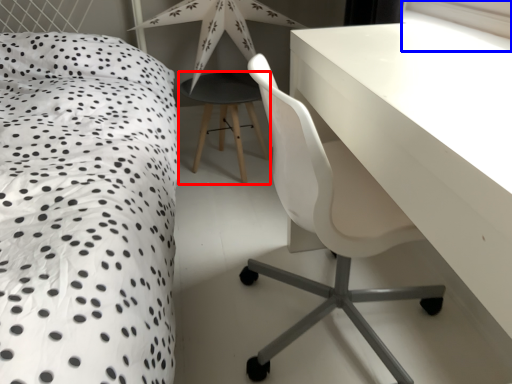
Question: Which object is closer to the camera taking this photo, bar stool (highlighted by a red box) or window screen (highlighted by a blue box)?

Choices:
 (A) bar stool
 (B) window screen

Answer: (B)